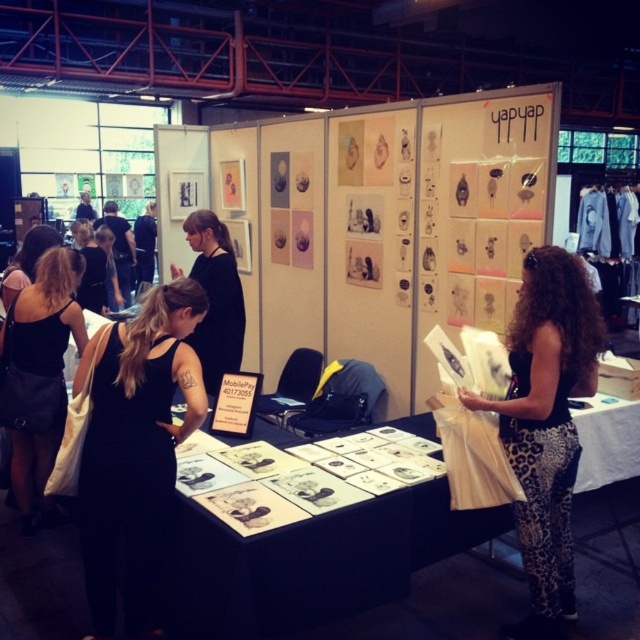
Looking at this image, you are a photographer at the event and need to capture both the leopard print pants at center and the black leather dress at left in a single frame. Which outfit will appear taller in the photo?

The leopard print pants at center will appear taller in the photo since it is much taller than the black leather dress at left according to the description.

You are an event planner organizing a fashion show and need to decide which outfit takes up more space in the walkway. Based on the scene, which of the leopard print pants at center or the black leather dress at left requires more space?

The black leather dress at left requires more space because it has a greater width compared to the leopard print pants at center.

You are an artist at the event and want to display your new artwork. You have a piece that is the same size as the leopard print pants at center. Will it fit on the white paper at center without overlapping?

The white paper at center is larger in size than the leopard print pants at center, so yes, the artwork will fit on the white paper at center without overlapping.